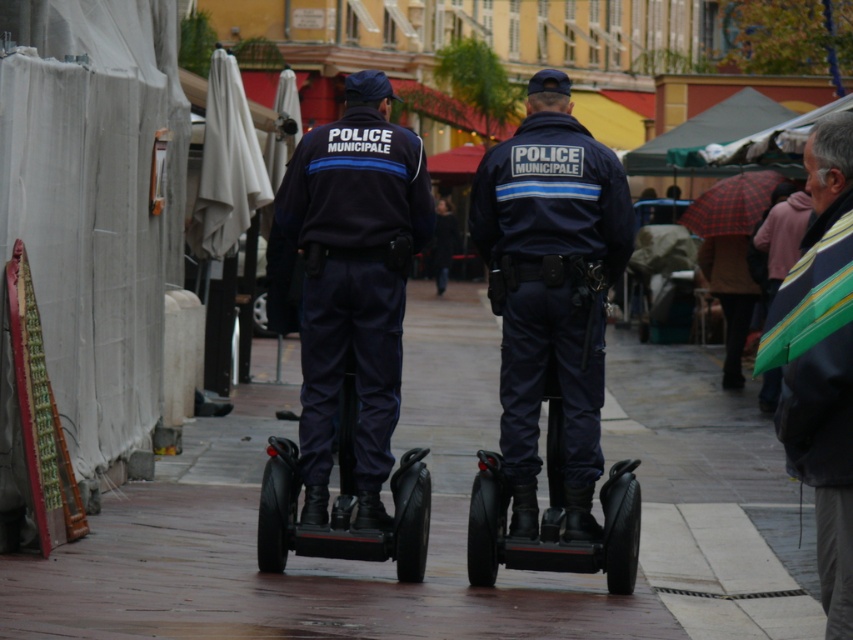
Looking at this image, which of these two, navy blue uniform at center or striped fabric umbrella at lower right, stands taller?

striped fabric umbrella at lower right is taller.

Is the position of navy blue uniform at center more distant than that of striped fabric umbrella at lower right?

Yes, navy blue uniform at center is behind striped fabric umbrella at lower right.

The width and height of the screenshot is (853, 640). I want to click on navy blue uniform at center, so click(550, 289).

Can you confirm if black rubber segway at center is taller than dark blue uniform at center?

In fact, black rubber segway at center may be shorter than dark blue uniform at center.

Is point (759, 602) positioned in front of point (370, 113)?

No, it is behind (370, 113).

Identify the location of black rubber segway at center. (444, 516).

Can you confirm if navy blue uniform at center is thinner than dark blue uniform at center?

Correct, navy blue uniform at center's width is less than dark blue uniform at center's.

Is navy blue uniform at center wider than dark blue uniform at center?

Incorrect, navy blue uniform at center's width does not surpass dark blue uniform at center's.

Is point (535, 83) in front of point (367, 412)?

No, it is not.

Locate an element on the screen. This screenshot has width=853, height=640. navy blue uniform at center is located at coordinates (550, 289).